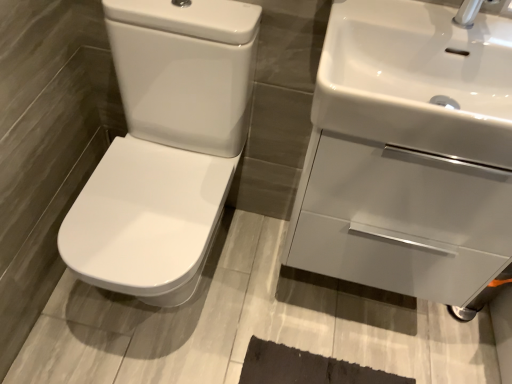
The width and height of the screenshot is (512, 384). What are the coordinates of `vacant area that lies to the right of white glossy toilet at left` in the screenshot? It's located at (276, 297).